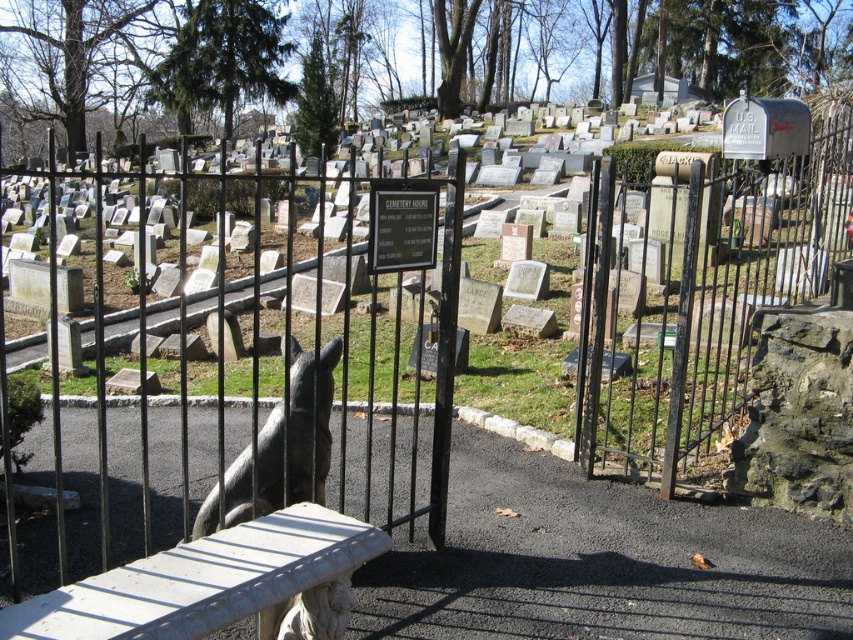
Does rusty metal gate at right appear on the right side of shiny black statue at center?

Yes, rusty metal gate at right is to the right of shiny black statue at center.

Is point (708, 369) positioned in front of point (337, 348)?

No.

What do you see at coordinates (714, 292) in the screenshot? I see `rusty metal gate at right` at bounding box center [714, 292].

Image resolution: width=853 pixels, height=640 pixels. I want to click on rusty metal gate at right, so click(714, 292).

Is the position of black wrought iron gate at center more distant than that of shiny black statue at center?

No.

Does black wrought iron gate at center appear on the left side of shiny black statue at center?

Yes, black wrought iron gate at center is to the left of shiny black statue at center.

Is point (83, 548) positioned behind point (259, 458)?

Yes, it is behind point (259, 458).

Identify the location of black wrought iron gate at center. (230, 420).

Who is more distant from viewer, (136, 307) or (833, 156)?

Positioned behind is point (136, 307).

Does black wrought iron gate at center have a smaller size compared to rusty metal gate at right?

No.

Where is `black wrought iron gate at center`? black wrought iron gate at center is located at coordinates (230, 420).

The width and height of the screenshot is (853, 640). I want to click on black wrought iron gate at center, so click(x=230, y=420).